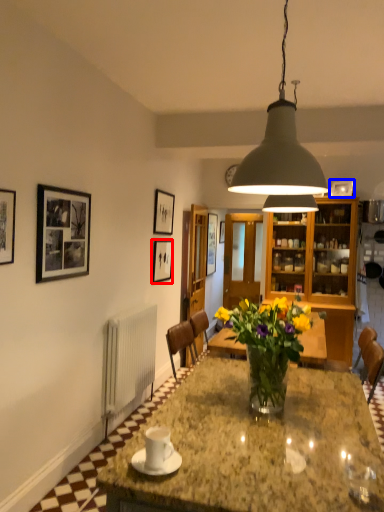
Question: Which object is closer to the camera taking this photo, picture frame (highlighted by a red box) or picture frame (highlighted by a blue box)?

Choices:
 (A) picture frame
 (B) picture frame

Answer: (A)